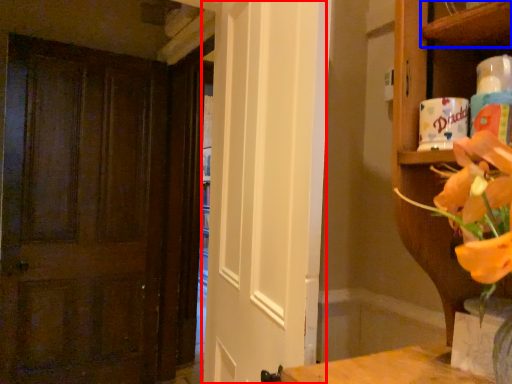
Question: Which of the following is the closest to the observer, screen door (highlighted by a red box) or shelf (highlighted by a blue box)?

Choices:
 (A) screen door
 (B) shelf

Answer: (B)